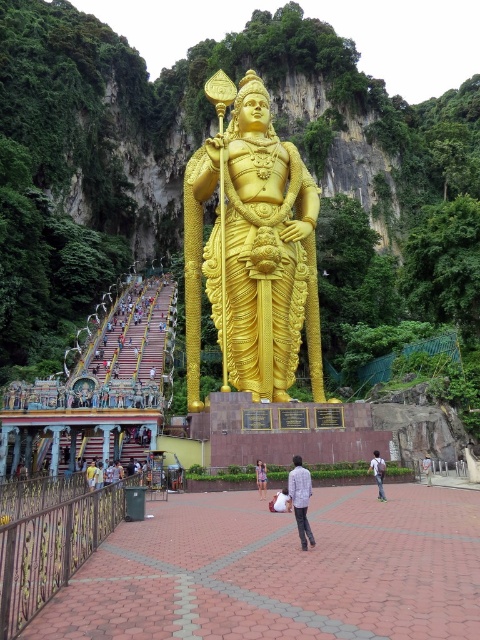
You are a visitor standing at the bottom of the steep staircase leading to the temple structure. You want to place a pair of light blue denim jeans at center exactly halfway between you and the temple structure. Is this possible?

The light blue denim jeans at center are placed exactly halfway between you and the temple structure, so yes, placing them there is possible since the distance from you to the temple structure is twice the distance from you to the jeans.